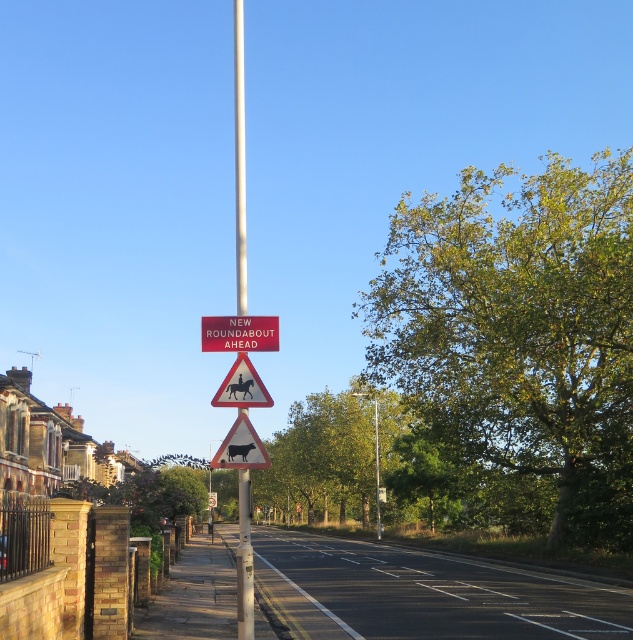
You are driving a car that is 4.5 meters long. You see the point at coordinates point (242, 556). Can you determine if your car can completely pass through the area before reaching that point?

The point at coordinates point (242, 556) is 8.01 meters away from the camera. Since your car is 4.5 meters long, you have enough space to completely pass through the area before reaching that point because the distance is greater than the car length.

You are driving along the road and see two points marked on the image. The first point is at coordinates point (x=360, y=444) and the second is at point (x=239, y=22). Which point is closer to the road sign indicating a roundabout ahead?

Point (x=360, y=444) is in front of point (x=239, y=22), so the point (x=360, y=444) is closer to the road sign indicating a roundabout ahead.